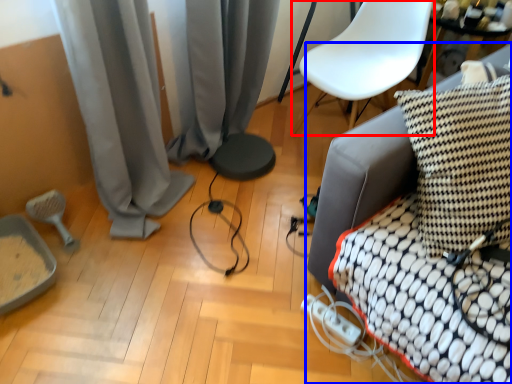
Question: Which object is further to the camera taking this photo, armchair (highlighted by a red box) or furniture (highlighted by a blue box)?

Choices:
 (A) armchair
 (B) furniture

Answer: (A)